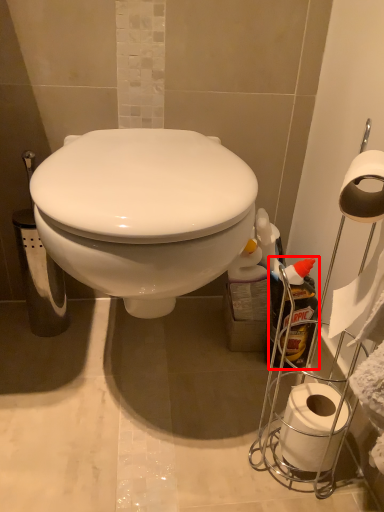
Question: Observing the image, what is the correct spatial positioning of cleaning product (annotated by the red box) in reference to toilet paper?

Choices:
 (A) right
 (B) left

Answer: (A)